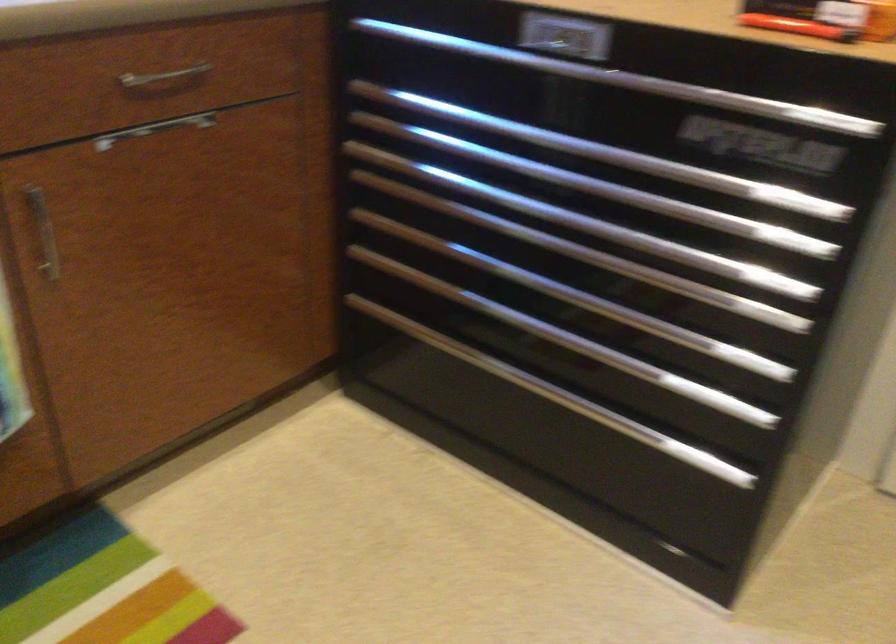
Where would you pull the silver drawer handle? Please return your answer as a coordinate pair (x, y).

(668, 88)